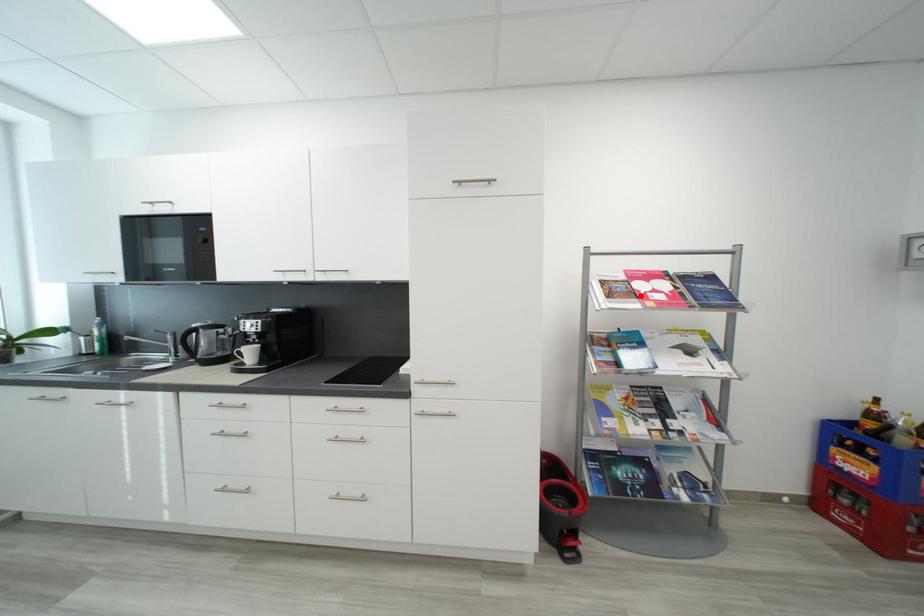
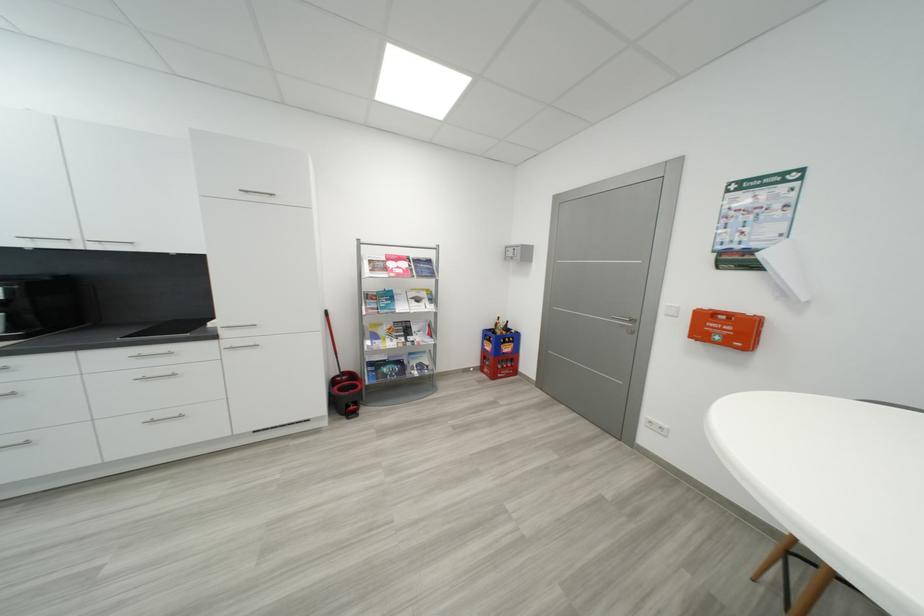
Where in the second image is the point corresponding to the highlighted location from the first image?

(393, 270)